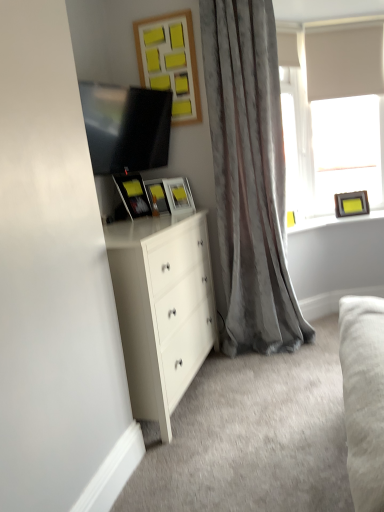
Question: Is matte black picture frame at center, which appears as the 1th picture frame when viewed from the left, facing away from matte black tv at upper left?

Choices:
 (A) yes
 (B) no

Answer: (B)

Question: Can you confirm if matte black picture frame at center, which appears as the 1th picture frame when viewed from the left, is positioned to the left of matte black tv at upper left?

Choices:
 (A) no
 (B) yes

Answer: (B)

Question: Does matte black picture frame at center, which appears as the 1th picture frame when viewed from the left, come behind matte black tv at upper left?

Choices:
 (A) yes
 (B) no

Answer: (A)

Question: From a real-world perspective, does matte black picture frame at center, which appears as the 1th picture frame when viewed from the left, stand above matte black tv at upper left?

Choices:
 (A) no
 (B) yes

Answer: (A)

Question: Is matte black picture frame at center, which appears as the 1th picture frame when viewed from the left, wider than matte black tv at upper left?

Choices:
 (A) no
 (B) yes

Answer: (A)

Question: Does matte black picture frame at center, which appears as the 1th picture frame when viewed from the left, appear on the right side of matte black tv at upper left?

Choices:
 (A) yes
 (B) no

Answer: (B)

Question: From the image's perspective, is matte white picture frame at center, marked as the 2th picture frame in a left-to-right arrangement, on top of matte black tv at upper left?

Choices:
 (A) yes
 (B) no

Answer: (B)

Question: Is matte white picture frame at center, arranged as the 4th picture frame when viewed from the right, shorter than matte black tv at upper left?

Choices:
 (A) no
 (B) yes

Answer: (B)

Question: Is matte black tv at upper left at the back of matte white picture frame at center, marked as the 2th picture frame in a left-to-right arrangement?

Choices:
 (A) no
 (B) yes

Answer: (A)

Question: Considering the relative positions of matte white picture frame at center, marked as the 2th picture frame in a left-to-right arrangement, and matte black tv at upper left in the image provided, is matte white picture frame at center, marked as the 2th picture frame in a left-to-right arrangement, to the left of matte black tv at upper left from the viewer's perspective?

Choices:
 (A) no
 (B) yes

Answer: (A)

Question: Is matte white picture frame at center, arranged as the 4th picture frame when viewed from the right, closer to camera compared to matte black tv at upper left?

Choices:
 (A) no
 (B) yes

Answer: (A)

Question: Is matte white picture frame at center, marked as the 2th picture frame in a left-to-right arrangement, wider than matte black tv at upper left?

Choices:
 (A) yes
 (B) no

Answer: (B)

Question: Can you confirm if matte black picture frame at upper right, the 1th picture frame from the right, is thinner than wooden yellow sticky notes at upper center, which is counted as the third picture frame, starting from the left?

Choices:
 (A) yes
 (B) no

Answer: (B)